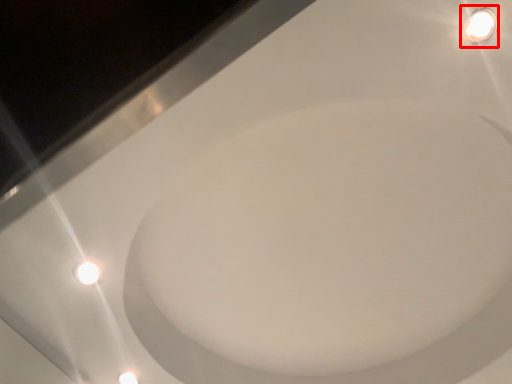
Question: Where is light fixture (annotated by the red box) located in relation to bath in the image?

Choices:
 (A) right
 (B) left

Answer: (A)